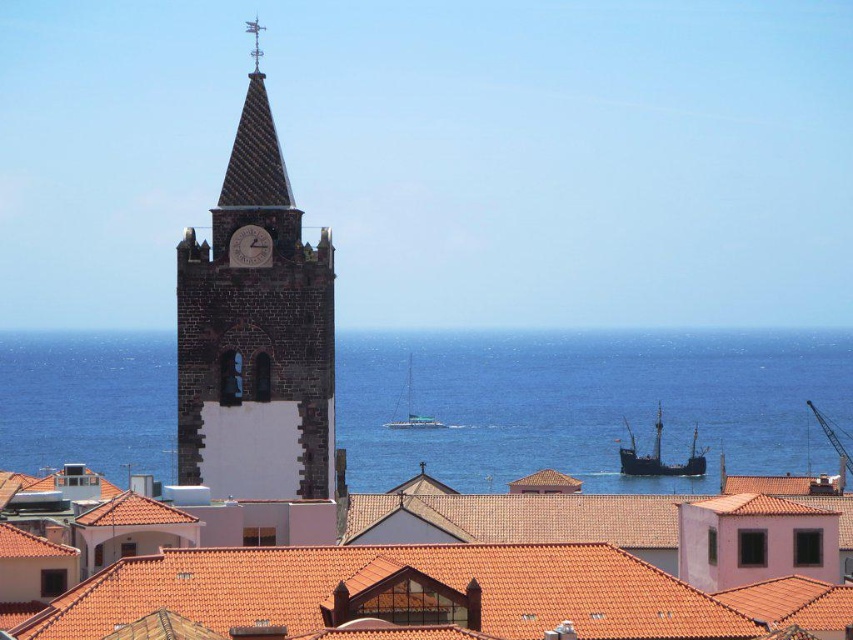
Question: Is blue water at center below matte stone clock at upper center?

Choices:
 (A) yes
 (B) no

Answer: (A)

Question: Does rusty wooden ship at center lie behind polished silver spire at upper center?

Choices:
 (A) yes
 (B) no

Answer: (A)

Question: Which point is closer to the camera?

Choices:
 (A) (405, 403)
 (B) (657, 458)
 (C) (267, 237)

Answer: (C)

Question: Which point is closer to the camera?

Choices:
 (A) (251, 243)
 (B) (201, 428)

Answer: (A)

Question: Which object is positioned farthest from the dark brown stone clock tower at left?

Choices:
 (A) white glossy sailboat at center
 (B) matte stone clock at upper center

Answer: (A)

Question: Is blue water at center to the right of polished silver spire at upper center from the viewer's perspective?

Choices:
 (A) no
 (B) yes

Answer: (B)